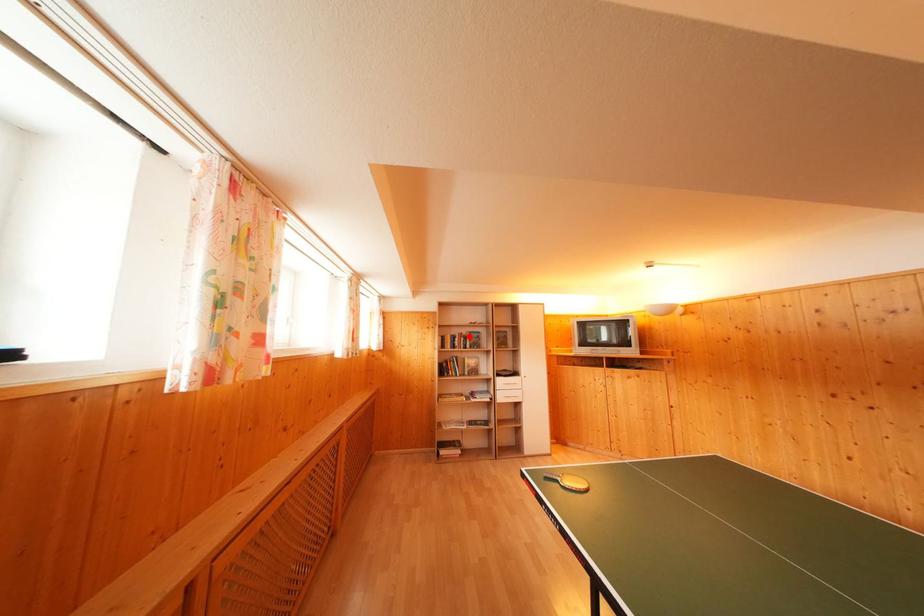
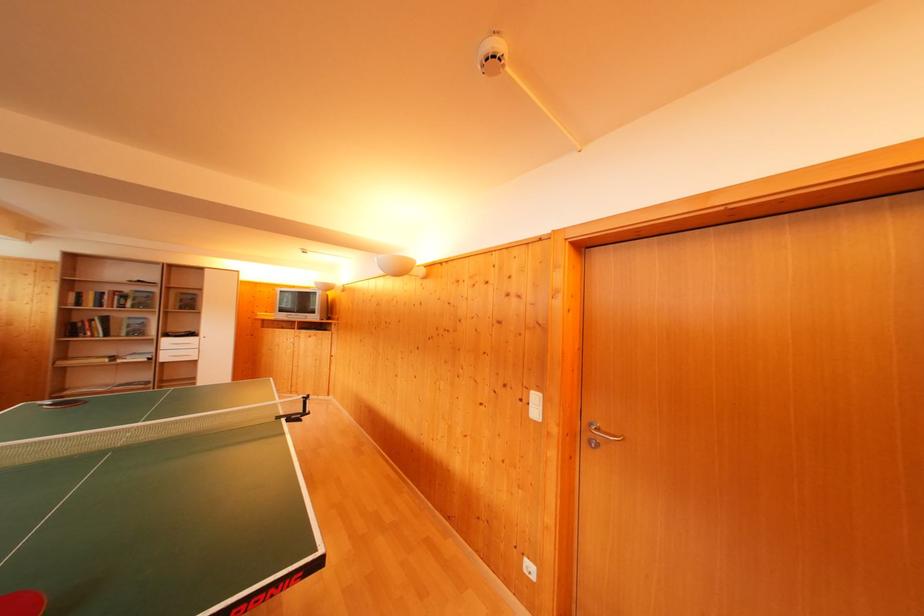
Find the pixel in the second image that matches the highlighted location in the first image.

(131, 294)